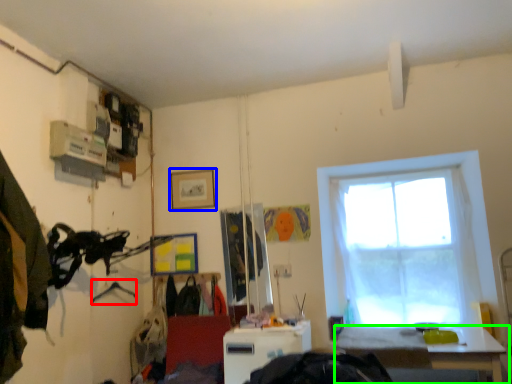
Question: Which object is the farthest from hanger (highlighted by a red box)? Choose among these: picture frame (highlighted by a blue box) or table (highlighted by a green box).

Choices:
 (A) picture frame
 (B) table

Answer: (B)